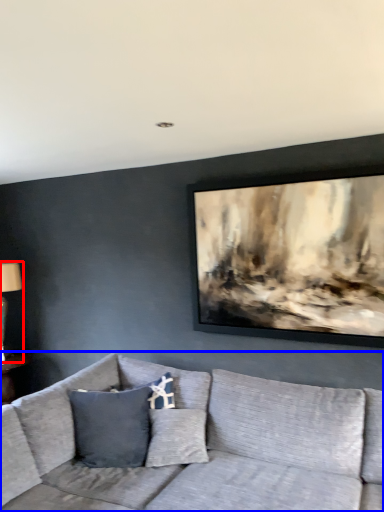
Question: Which point is further to the camera, table lamp (highlighted by a red box) or studio couch (highlighted by a blue box)?

Choices:
 (A) table lamp
 (B) studio couch

Answer: (A)